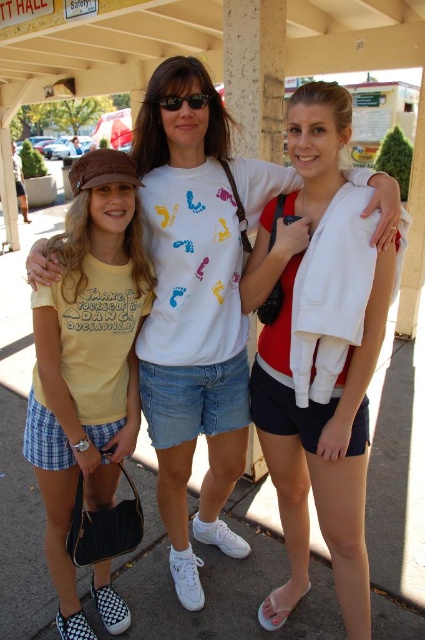
Question: Is yellow cotton t-shirt at left above black plastic sunglasses at center?

Choices:
 (A) yes
 (B) no

Answer: (B)

Question: Considering the relative positions of yellow cotton t-shirt at left and black plastic sunglasses at center in the image provided, where is yellow cotton t-shirt at left located with respect to black plastic sunglasses at center?

Choices:
 (A) above
 (B) below

Answer: (B)

Question: Which object is closer to the camera taking this photo?

Choices:
 (A) black plastic sunglasses at center
 (B) yellow cotton t-shirt at left

Answer: (B)

Question: Which point is closer to the camera?

Choices:
 (A) yellow cotton t-shirt at left
 (B) black plastic sunglasses at center
 (C) white cotton jacket at center

Answer: (C)

Question: Which object is farther from the camera taking this photo?

Choices:
 (A) black plastic sunglasses at center
 (B) yellow cotton t-shirt at left
 (C) white cotton jacket at center

Answer: (A)

Question: Is white cotton jacket at center wider than black plastic sunglasses at center?

Choices:
 (A) yes
 (B) no

Answer: (A)